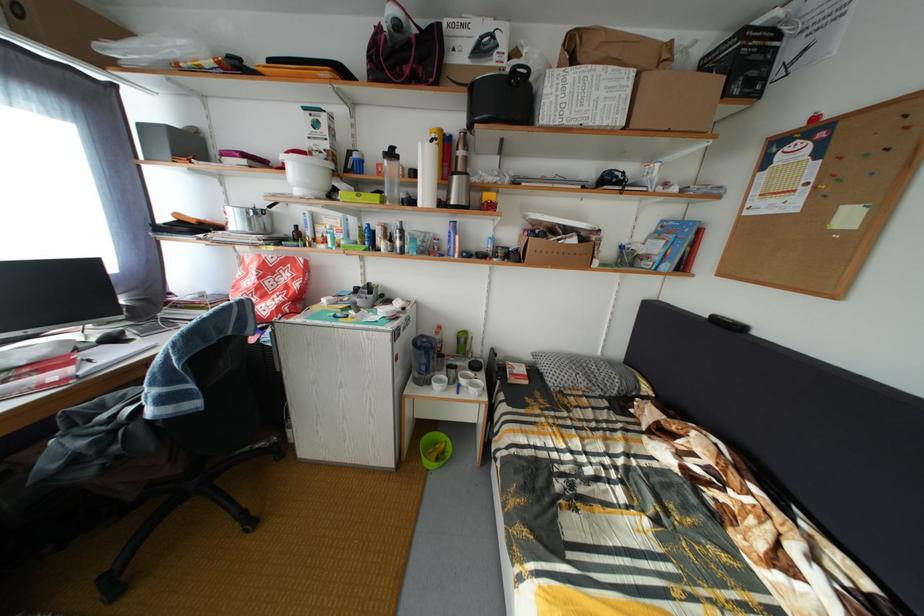
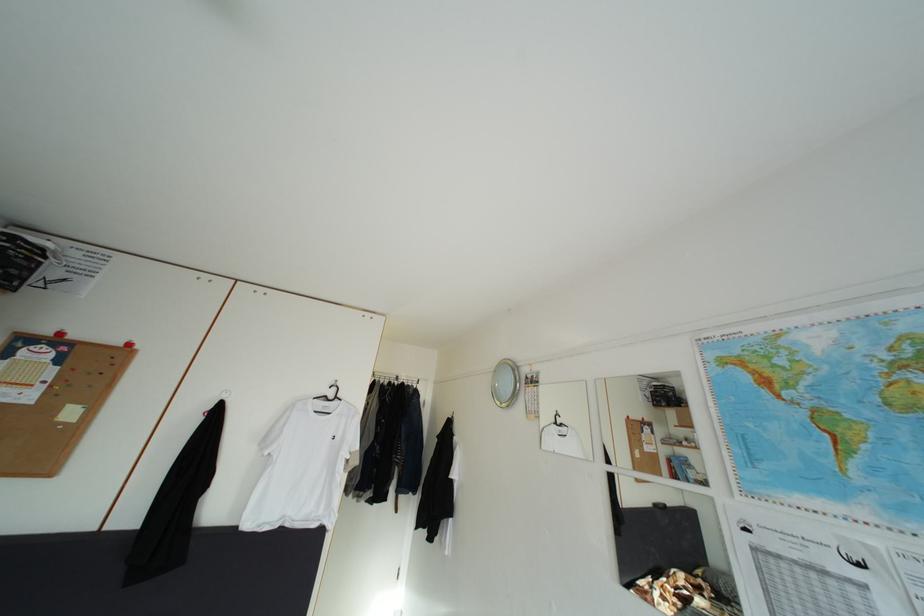
Question: Based on the continuous images, in which direction is the camera rotating? Reply with the corresponding letter.

Choices:
 (A) Left
 (B) Right
 (C) Up
 (D) Down

Answer: (B)